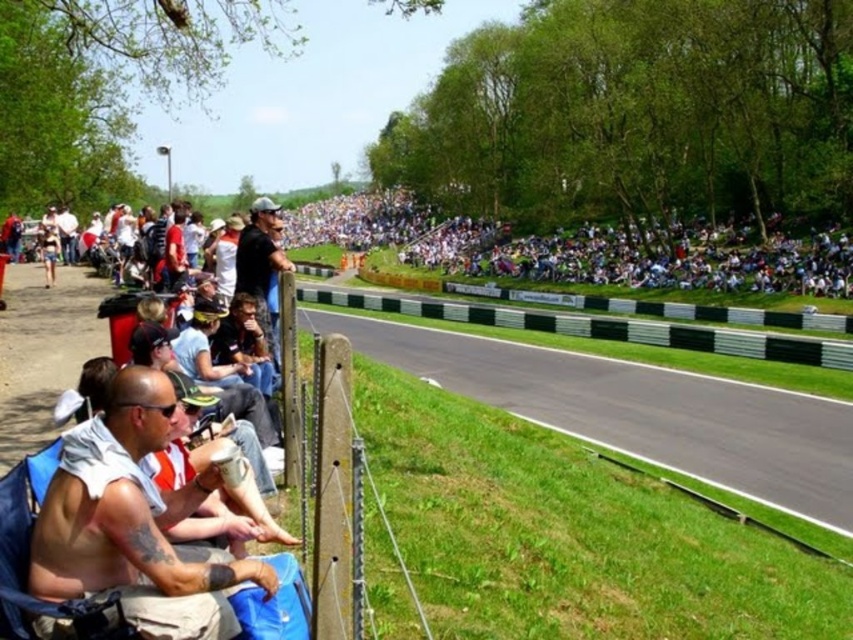
Does black asphalt at center have a lesser height compared to white cotton shirt at center?

Correct, black asphalt at center is not as tall as white cotton shirt at center.

Who is positioned more to the right, black asphalt at center or white cotton shirt at center?

From the viewer's perspective, black asphalt at center appears more on the right side.

Does point (804, 428) come in front of point (766, 280)?

That is True.

Identify the location of black asphalt at center. This screenshot has height=640, width=853. (x=640, y=412).

Is point (128, 525) positioned in front of point (550, 324)?

Yes.

This screenshot has width=853, height=640. I want to click on white cotton shirt at lower left, so click(x=134, y=522).

Is black asphalt at center thinner than white cotton shirt at lower left?

No, black asphalt at center is not thinner than white cotton shirt at lower left.

Can you confirm if black asphalt at center is shorter than white cotton shirt at lower left?

In fact, black asphalt at center may be taller than white cotton shirt at lower left.

Between point (815, 499) and point (149, 508), which one is positioned behind?

The point (815, 499) is more distant.

Where is `black asphalt at center`? black asphalt at center is located at coordinates (640, 412).